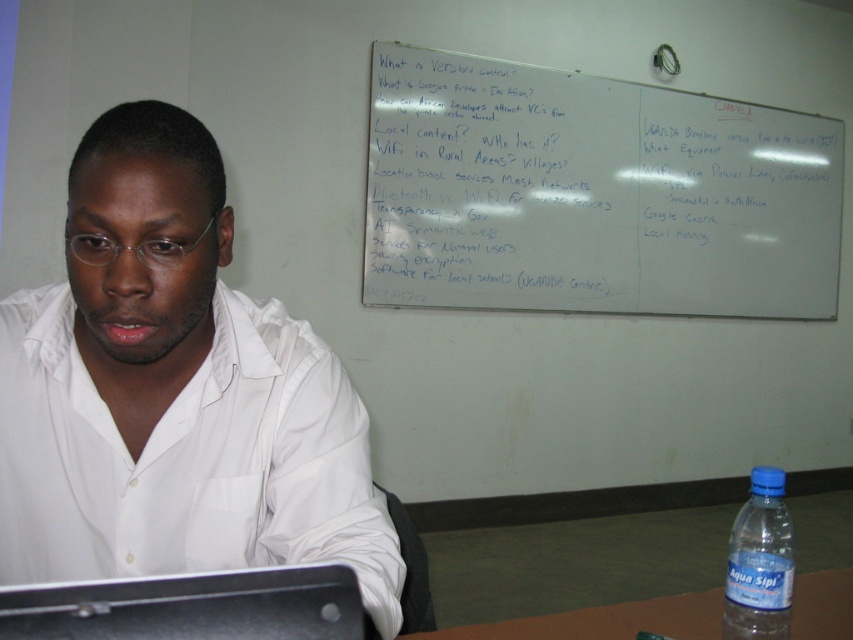
Can you confirm if black matte laptop at lower left is positioned below blue plastic bottle at lower right?

Incorrect, black matte laptop at lower left is not positioned below blue plastic bottle at lower right.

How far apart are black matte laptop at lower left and blue plastic bottle at lower right?

The distance of black matte laptop at lower left from blue plastic bottle at lower right is 79.17 centimeters.

Does point (148, 579) lie behind point (732, 589)?

No, (148, 579) is in front of (732, 589).

The height and width of the screenshot is (640, 853). What are the coordinates of `black matte laptop at lower left` in the screenshot? It's located at (192, 608).

Is white matte shirt at center bigger than brown wood table at lower right?

Correct, white matte shirt at center is larger in size than brown wood table at lower right.

Is point (74, 394) positioned after point (817, 627)?

No, it is in front of (817, 627).

Identify the location of white matte shirt at center. The width and height of the screenshot is (853, 640). (173, 392).

Who is more distant from viewer, (x=146, y=522) or (x=610, y=164)?

The point (x=610, y=164) is more distant.

Is white matte shirt at center closer to the viewer compared to whiteboard at upper center?

Yes.

The width and height of the screenshot is (853, 640). What are the coordinates of `white matte shirt at center` in the screenshot? It's located at (173, 392).

Locate an element on the screen. white matte shirt at center is located at coordinates (173, 392).